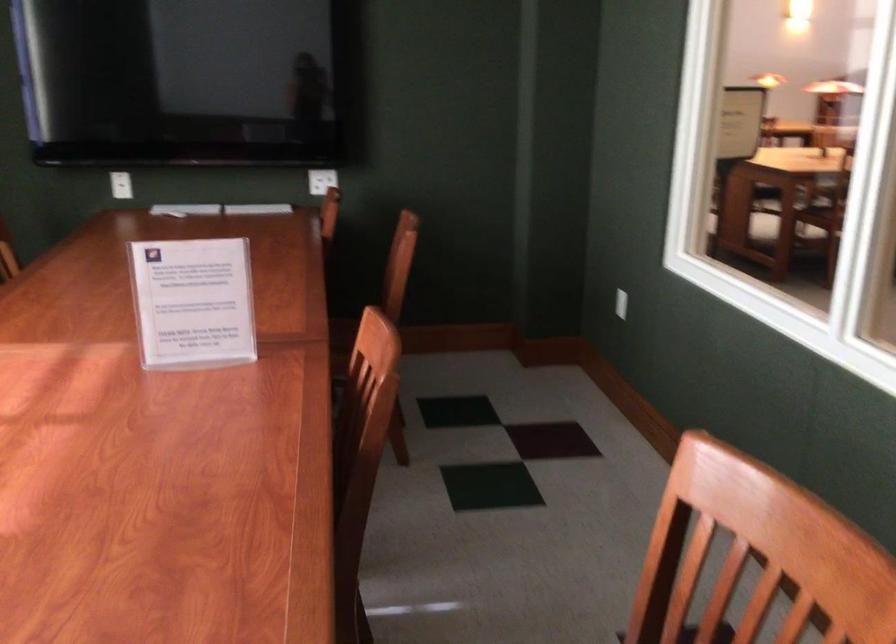
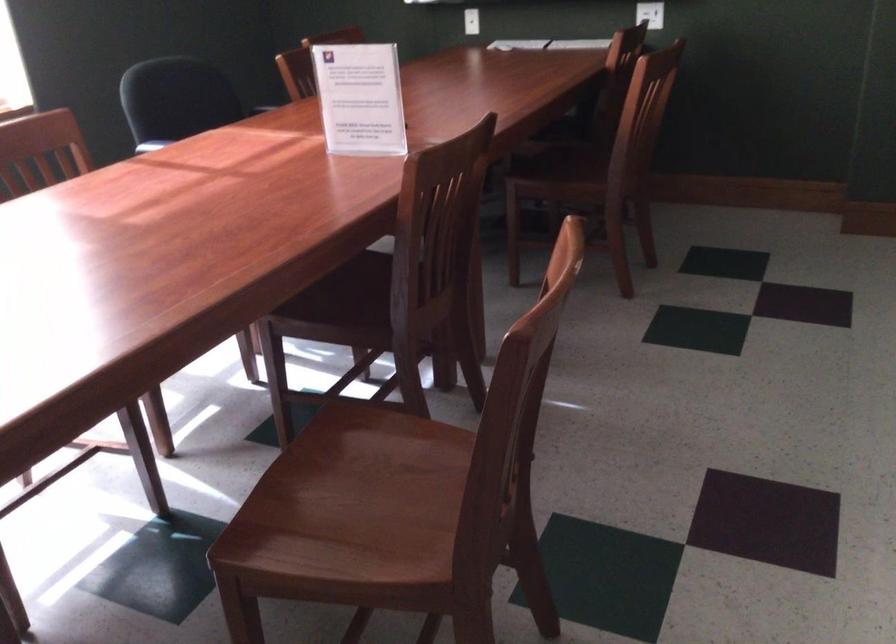
In the second image, find the point that corresponds to (x=337, y=183) in the first image.

(650, 14)